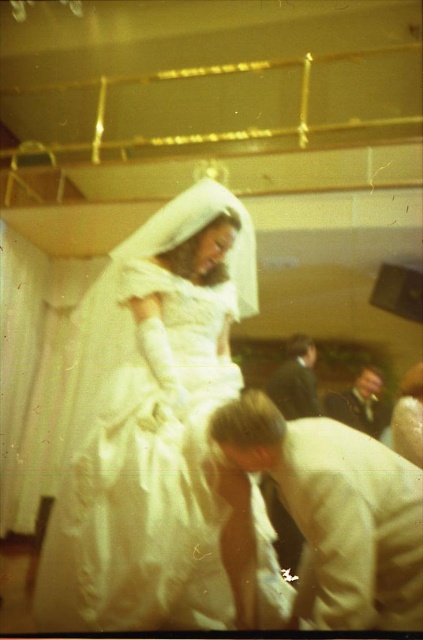
You are a photographer at the wedding reception and need to place a small bouquet between the white satin suit at lower center and the dark brown leather jacket at lower right. Given their sizes, which object should the bouquet be closer to to ensure it doesn

The white satin suit at lower center has a larger size compared to dark brown leather jacket at lower right. Therefore, the bouquet should be placed closer to the dark brown leather jacket at lower right to balance the composition.

Based on the photo, you are a photographer adjusting your camera settings to capture the bride in the white satin dress at center. To ensure the dress is in focus, where should you position the camera relative to the dress?

The white satin dress at center is located at point (159, 436), so you should position the camera directly facing the coordinates (159, 436) to ensure the dress is in focus.

You are a photographer at a wedding reception. You need to position yourself so that you can capture both the white satin suit at lower center and the dark brown leather jacket at lower right in the same frame. Based on their positions, which one should you focus on first to ensure both are in the shot?

The white satin suit at lower center is below the dark brown leather jacket at lower right, so you should focus on the dark brown leather jacket at lower right first to ensure both are in the frame.